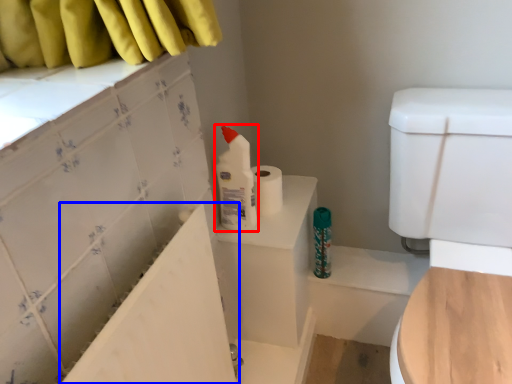
Question: Which point is closer to the camera, cleaning product (highlighted by a red box) or bath (highlighted by a blue box)?

Choices:
 (A) cleaning product
 (B) bath

Answer: (B)